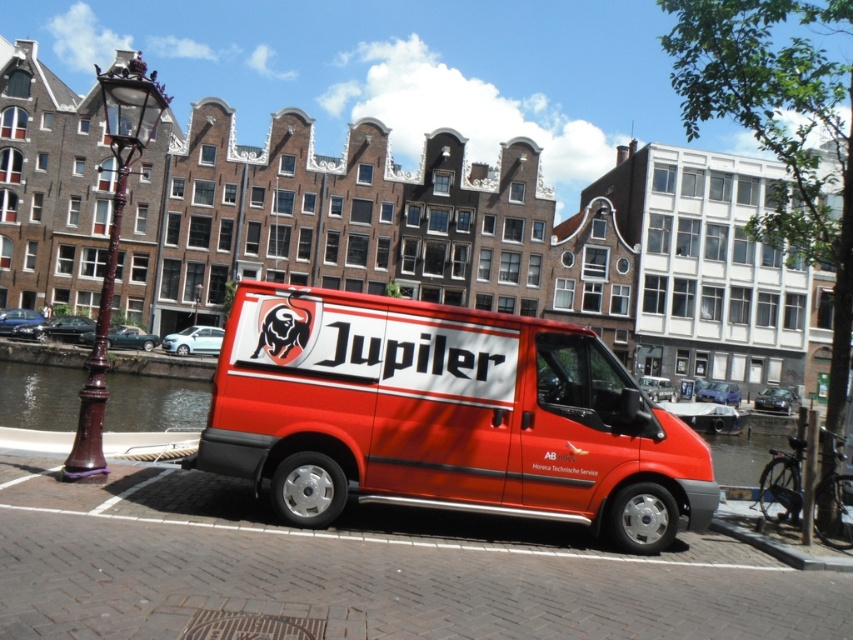
Question: Is bronze lamppost at left smaller than transparent water at left?

Choices:
 (A) no
 (B) yes

Answer: (A)

Question: Is shiny red van at center smaller than bronze lamppost at left?

Choices:
 (A) no
 (B) yes

Answer: (B)

Question: Which object is the farthest from the bronze lamppost at left?

Choices:
 (A) transparent water at left
 (B) shiny red van at center

Answer: (B)

Question: Which of the following is the closest to the observer?

Choices:
 (A) (691, 509)
 (B) (120, 381)

Answer: (A)

Question: Which point is closer to the camera?

Choices:
 (A) (77, 378)
 (B) (136, 77)

Answer: (B)

Question: Can you confirm if shiny red van at center is positioned to the left of bronze lamppost at left?

Choices:
 (A) no
 (B) yes

Answer: (A)